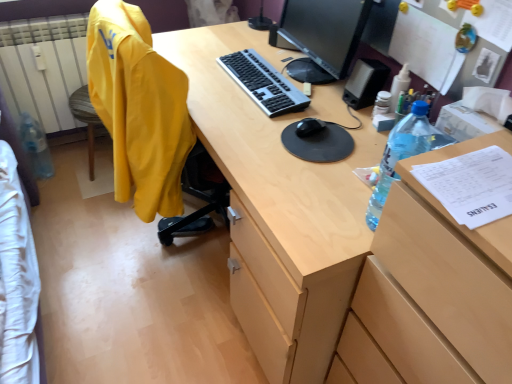
You are a GUI agent. You are given a task and a screenshot of the screen. Output one action in this format:
    pyautogui.click(x=<x>, y=<y>)
    Task: Click on the vacant space to the right of silver/black plastic keyboard at center
    Image resolution: width=512 pixels, height=384 pixels.
    Given the screenshot: What is the action you would take?
    pyautogui.click(x=310, y=74)